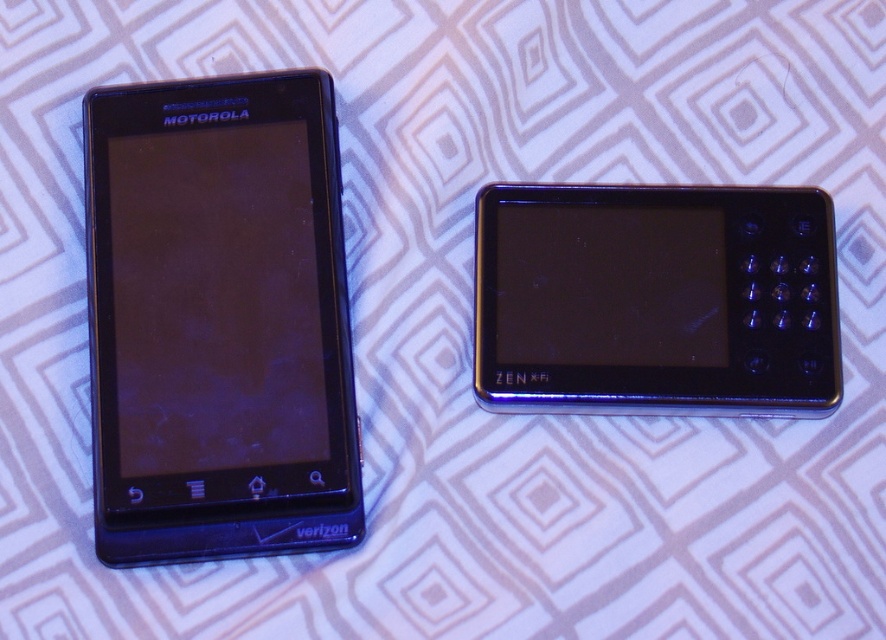
You are setting up a display for a tech store and need to arrange the black glossy smartphone at left and the black plastic zen phone at right according to their actual positions. Based on the scene description, which device should be placed lower on the shelf?

The black glossy smartphone at left should be placed lower on the shelf because it is located below the black plastic zen phone at right according to the scene description.

You are standing in front of two electronic devices on a geometric patterned surface. You see a Motorola smartphone on the left and a point at coordinate (323,112) on the right. Which object is closer to you?

The point at coordinate (323,112) is 4.51 feet from the viewer, so it is closer than the Motorola smartphone on the left.

You are a delivery person who needs to place a package on the patterned surface with geometric diamond shapes. The surface has a coordinate system where the bottom left corner is the origin. The Motorola smartphone is at the left, and there is a point marked at coordinate (218, 321). Where should you place the package so it doesn,t overlap with the smartphone or the point? Please provide coordinates within the range of 0 to 1 for both x and y axes.

The package should be placed at coordinates outside the area occupied by the black glossy smartphone at left and the point at (218, 321). For example, placing it at 0.3, 0.4 would avoid both the smartphone and the point.